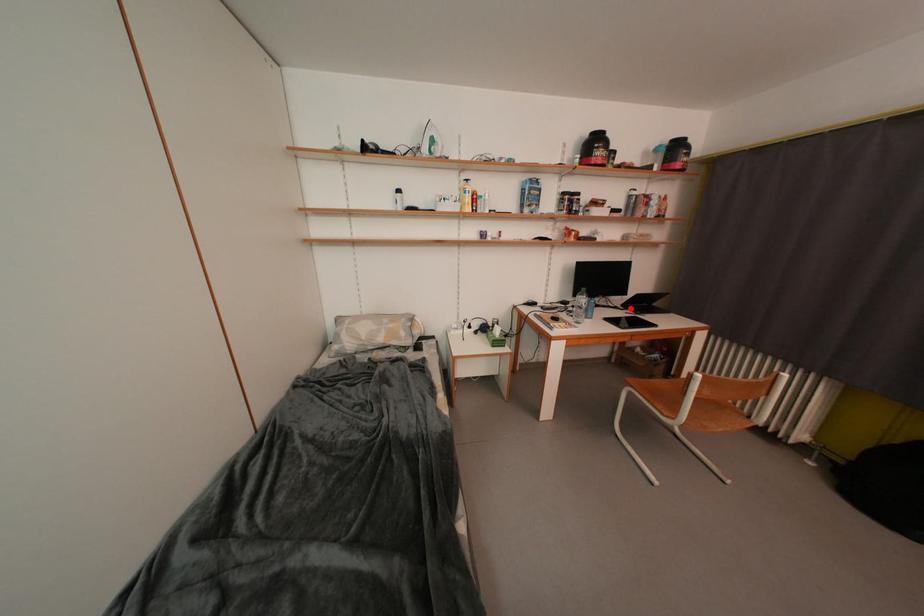
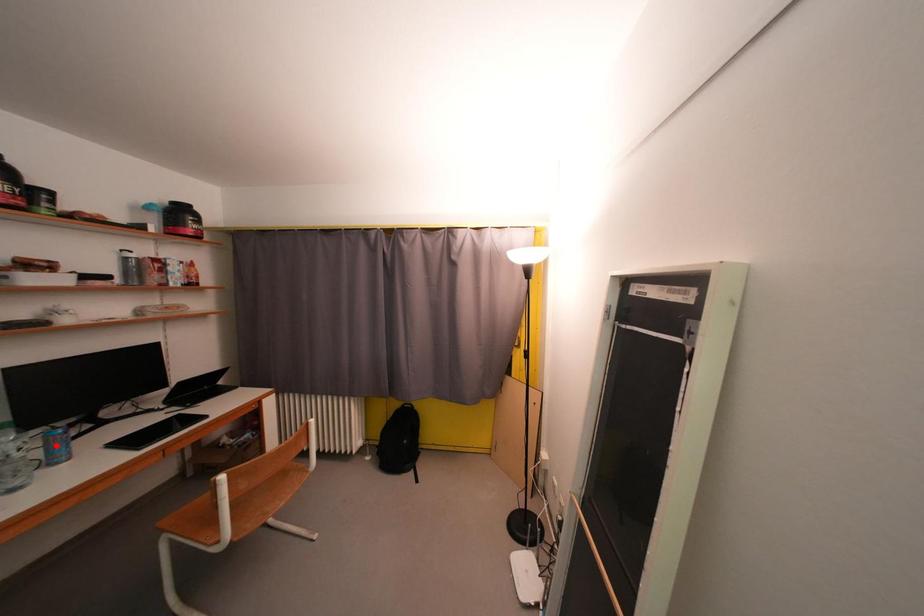
I am providing you with two images of the same scene from different viewpoints. A red point is marked on the first image and another point is marked on the second image. Do the highlighted points in image1 and image2 indicate the same real-world spot?

No